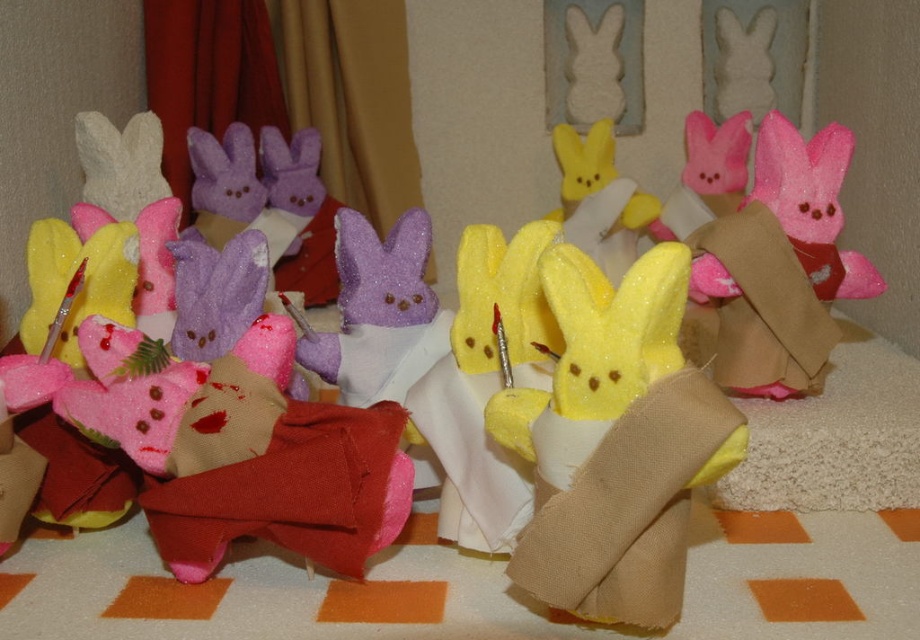
Question: Does glittery yellow bunny at center come in front of pink felt bunny at center?

Choices:
 (A) yes
 (B) no

Answer: (A)

Question: Is the position of glittery yellow bunny at center more distant than that of pink felt bunny at center?

Choices:
 (A) yes
 (B) no

Answer: (B)

Question: Which of the following is the farthest from the observer?

Choices:
 (A) (710, 224)
 (B) (681, 536)

Answer: (A)

Question: Which point is closer to the camera taking this photo?

Choices:
 (A) (824, 317)
 (B) (652, 324)

Answer: (B)

Question: Does glittery yellow bunny at center appear under pink felt bunny at center?

Choices:
 (A) yes
 (B) no

Answer: (A)